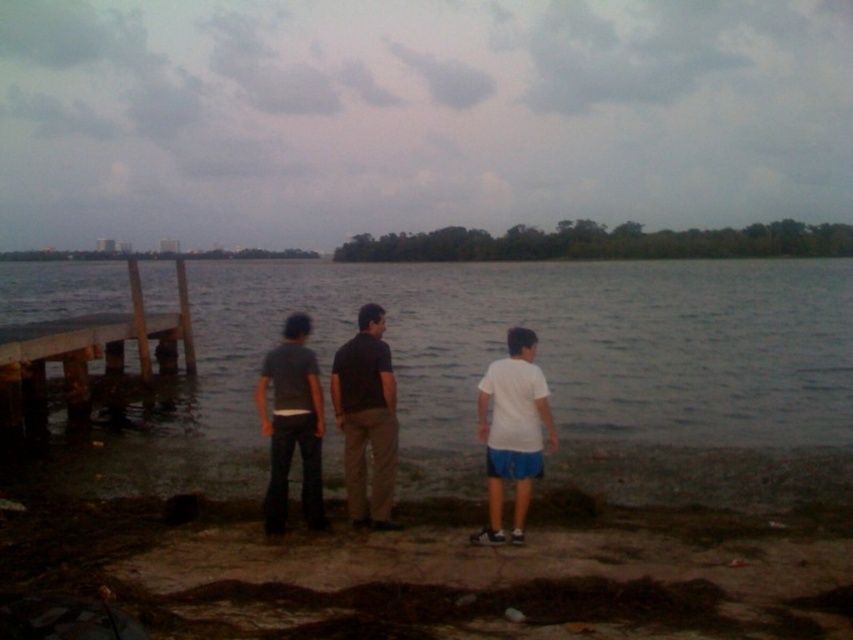
You are standing at the point with coordinates (428, 572) on the lakeside. What material are you standing on?

You are standing on brown dirt at lower center.

You are standing on the shore and want to reach the brown wooden dock at left. According to the coordinates provided, in which direction should you head from your current position?

The brown wooden dock at left is located at coordinates point (88, 349), so you should head towards the left side of the scene to reach it.